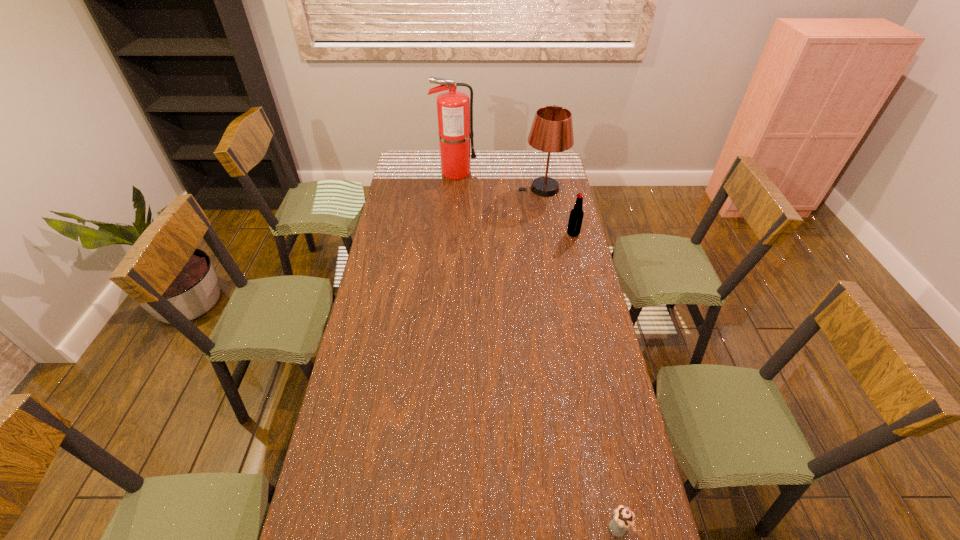
The image size is (960, 540). In order to click on free point between the second shortest object and the lampshade in this screenshot , I will do `click(558, 211)`.

Where is `empty space that is in between the fire extinguisher and the second tallest object`? This screenshot has height=540, width=960. empty space that is in between the fire extinguisher and the second tallest object is located at coordinates tap(499, 180).

The width and height of the screenshot is (960, 540). What are the coordinates of `free spot between the third tallest object and the lampshade` in the screenshot? It's located at (558, 211).

Choose which object is the second nearest neighbor to the fire extinguisher. Please provide its 2D coordinates. Your answer should be formatted as a tuple, i.e. [(x, y)], where the tuple contains the x and y coordinates of a point satisfying the conditions above.

[(576, 215)]

Identify which object is located as the third nearest to the second shortest object. Please provide its 2D coordinates. Your answer should be formatted as a tuple, i.e. [(x, y)], where the tuple contains the x and y coordinates of a point satisfying the conditions above.

[(624, 518)]

At what (x,y) coordinates should I click in order to perform the action: click on free location that satisfies the following two spatial constraints: 1. on the front-facing side of the lampshade; 2. on the left side of the beer bottle. Please return your answer as a coordinate pair (x, y). This screenshot has height=540, width=960. Looking at the image, I should click on (550, 234).

Where is `vacant position in the image that satisfies the following two spatial constraints: 1. at the nozzle of the second nearest object; 2. on the right side of the leftmost object`? The width and height of the screenshot is (960, 540). vacant position in the image that satisfies the following two spatial constraints: 1. at the nozzle of the second nearest object; 2. on the right side of the leftmost object is located at coordinates (451, 234).

Identify the location of vacant space that satisfies the following two spatial constraints: 1. at the nozzle of the third farthest object; 2. on the left side of the fire extinguisher. The width and height of the screenshot is (960, 540). (451, 234).

You are a GUI agent. You are given a task and a screenshot of the screen. Output one action in this format:
    pyautogui.click(x=<x>, y=<y>)
    Task: Click on the blank space that satisfies the following two spatial constraints: 1. on the front-facing side of the lampshade; 2. on the left side of the beer bottle
    This screenshot has height=540, width=960.
    Given the screenshot: What is the action you would take?
    pyautogui.click(x=550, y=234)

I want to click on free space that satisfies the following two spatial constraints: 1. at the nozzle of the leftmost object; 2. on the back side of the beer bottle, so click(x=451, y=234).